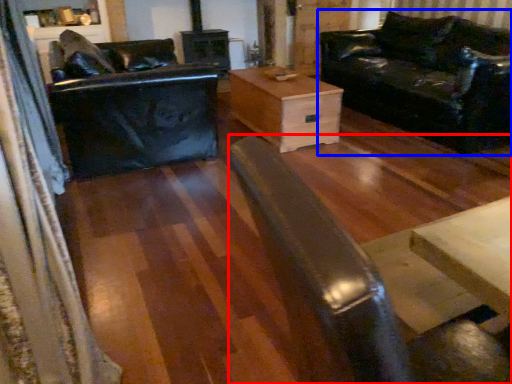
Question: Which object is further to the camera taking this photo, wide (highlighted by a red box) or studio couch (highlighted by a blue box)?

Choices:
 (A) wide
 (B) studio couch

Answer: (B)